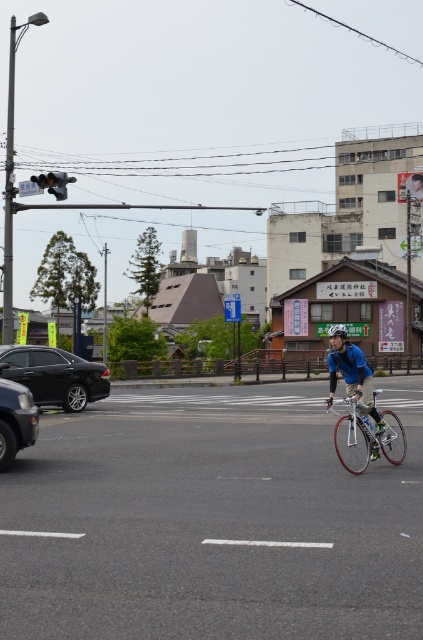
You are a pedestrian waiting at the crosswalk. You see the shiny black car at left and the metallic traffic light at upper left. Which object is closer to the left side of the road?

The metallic traffic light at upper left is closer to the left side of the road because the shiny black car at left is to the right of it.

You are a pedestrian waiting at the crosswalk. You see a cyclist wearing a blue fabric jacket at center and a shiny black car at left. Which object is bigger in the image?

The blue fabric jacket at center is larger in size compared to the shiny black car at left in the image.